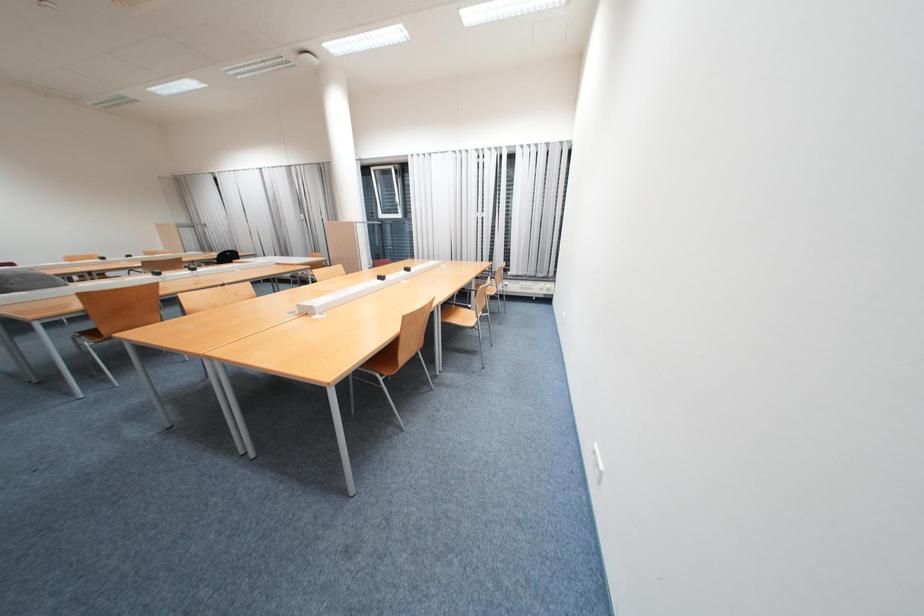
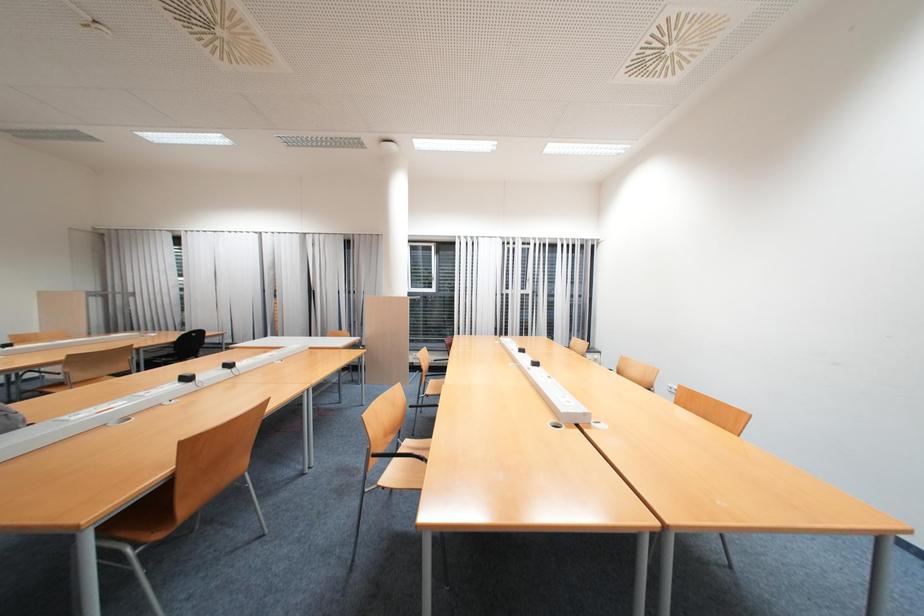
Question: Which direction would the cameraman need to move to produce the second image? Reply with the corresponding letter.

Choices:
 (A) Left
 (B) Right
 (C) Forward
 (D) Backward

Answer: (A)